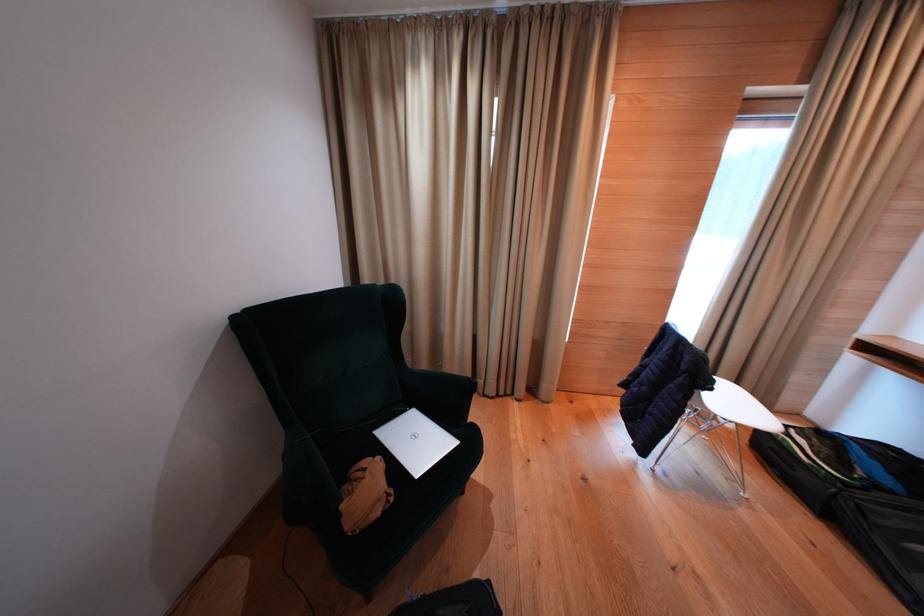
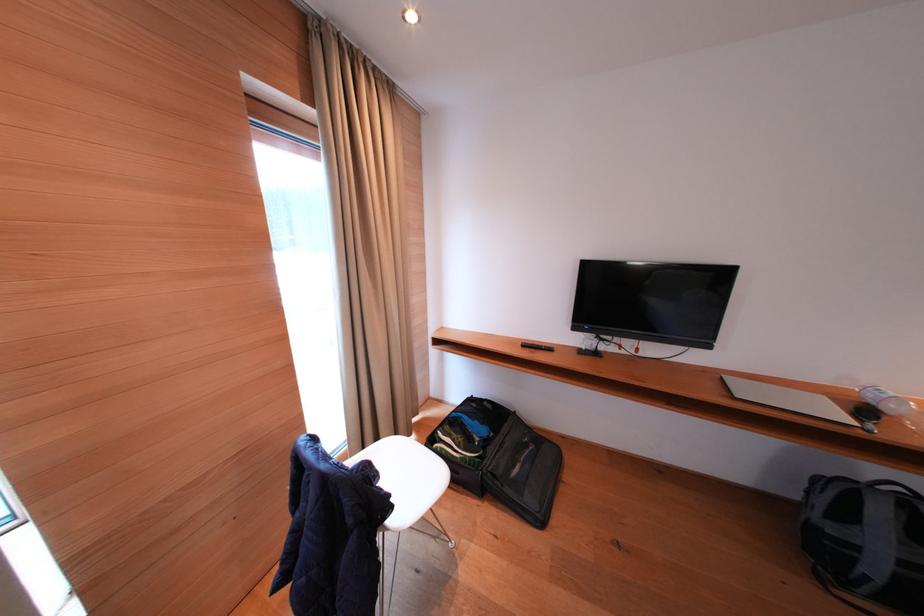
Locate, in the second image, the point that corresponds to point (808, 94) in the first image.

(317, 116)